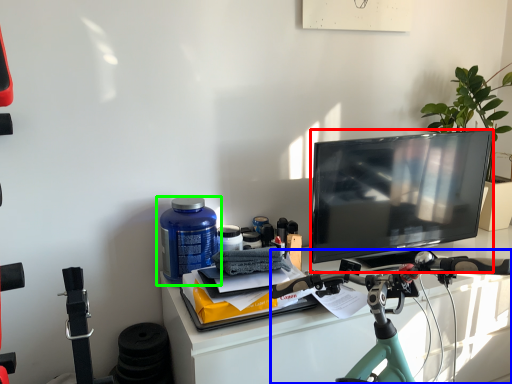
Question: Considering the real-world distances, which object is farthest from television (highlighted by a red box)? bicycle (highlighted by a blue box) or bottle (highlighted by a green box)?

Choices:
 (A) bicycle
 (B) bottle

Answer: (B)